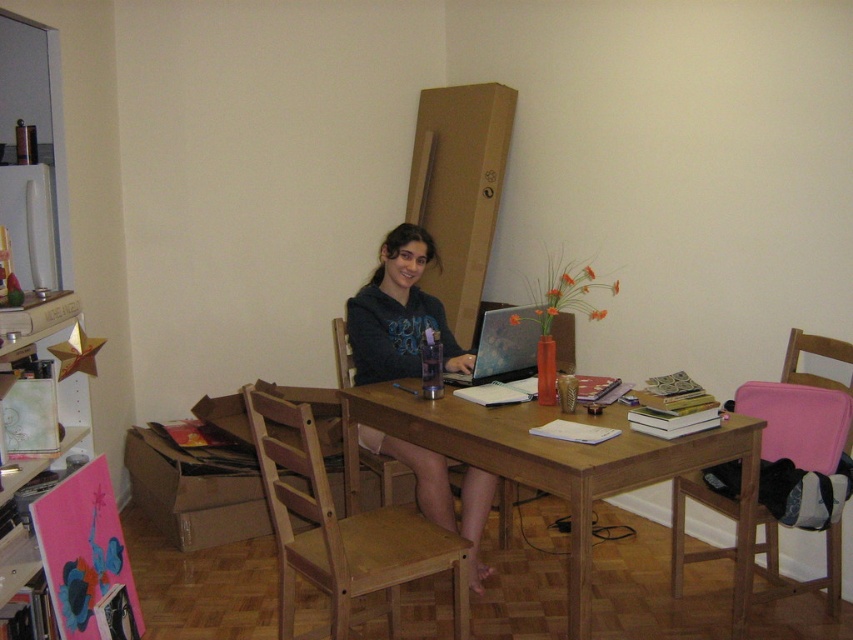
You are trying to determine if the light wood chair at center can fit through a doorway that is the same width as the matte black hoodie at center. Based on the scene description, will it fit?

The light wood chair at center is wider than the matte black hoodie at center, so it will not fit through a doorway that is the same width as the matte black hoodie at center.

You are standing in the room and want to place a 1.80 meter long ladder against the wall behind the wooden table at center. Is there enough space between you and the table to safely place the ladder without it hitting the table?

The distance between you and the wooden table at center is 2.00 meters. Since the ladder is 1.80 meters long, there is sufficient space to place it safely without hitting the table.

You are trying to place a new decorative item on the wooden table at center. Considering the height of the matte black hoodie at center, will the item be visible from above the table?

The wooden table at center has a lesser height compared to matte black hoodie at center. Since the hoodie is taller than the table, the decorative item placed on the table might be partially or fully obscured by the hoodie when viewed from above.